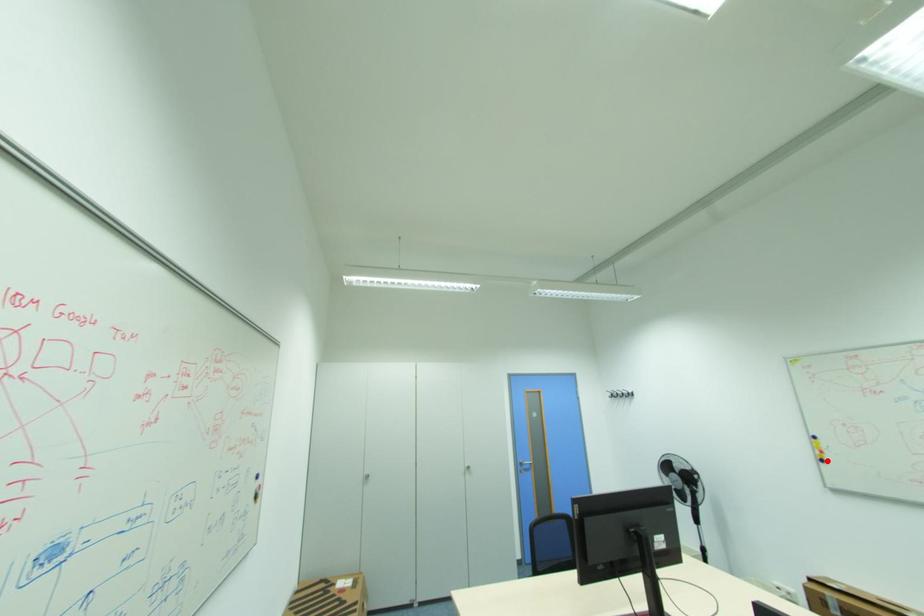
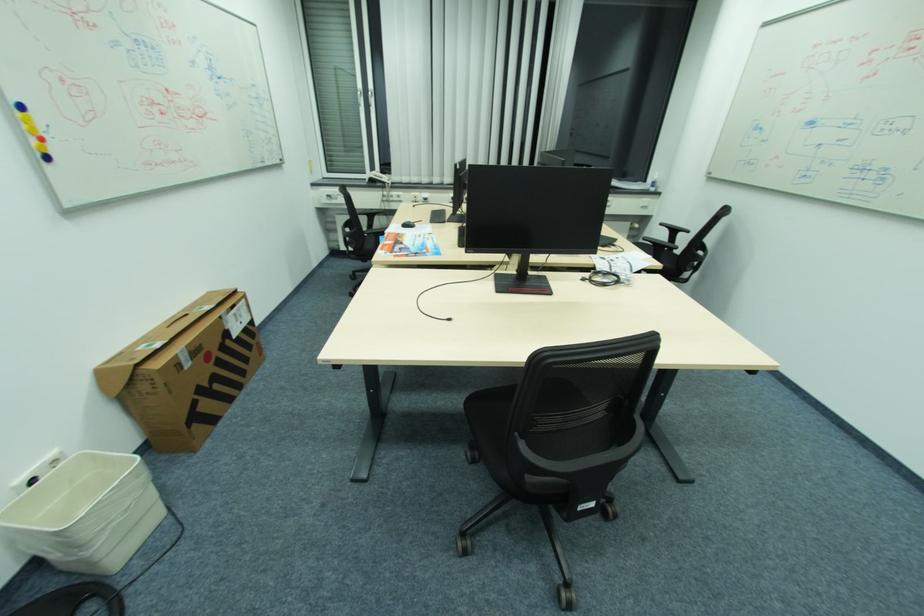
Question: I am providing you with two images of the same scene from different viewpoints. Image1 has a red point marked. In image2, the corresponding 3D location appears at what relative position? Reply with the corresponding letter.

Choices:
 (A) Closer
 (B) Farther

Answer: (B)